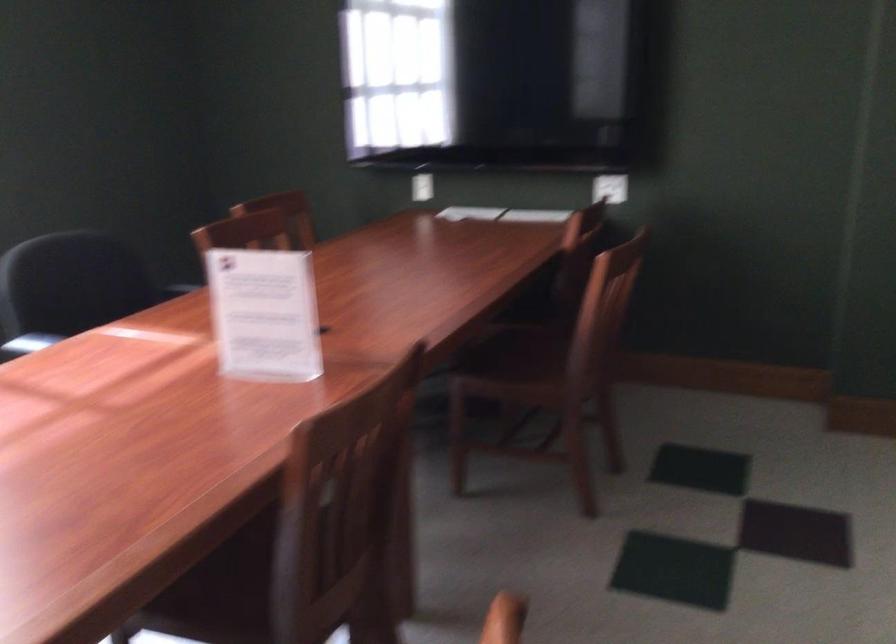
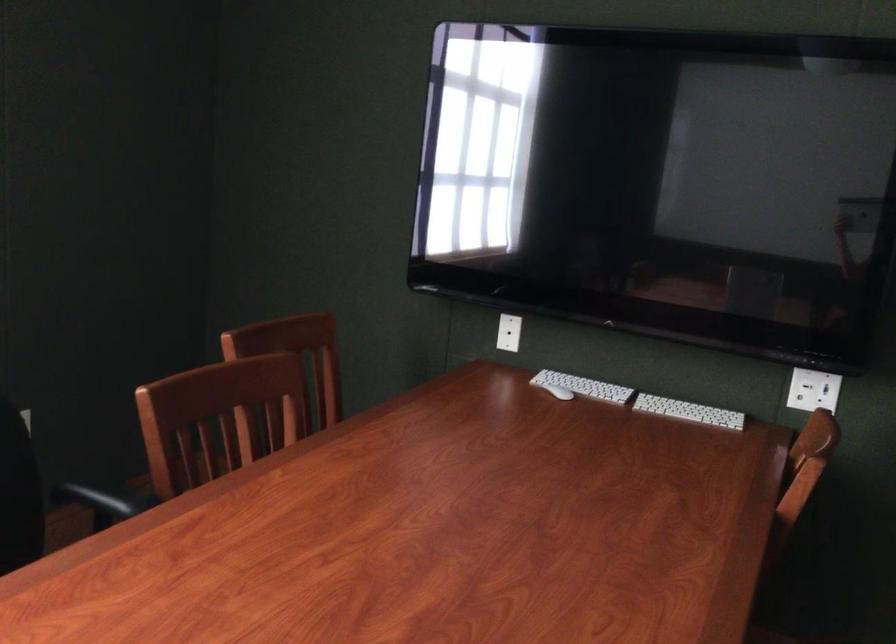
In the second image, find the point that corresponds to [471,210] in the first image.

(583, 386)